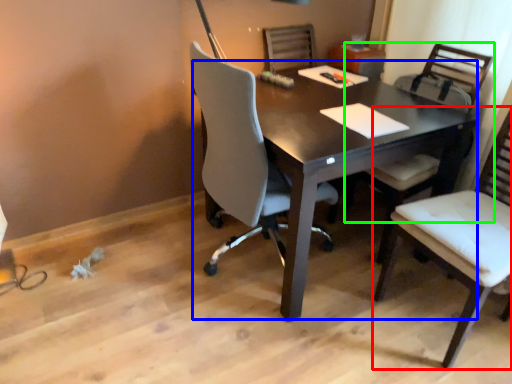
Question: Considering the real-world distances, which object is closest to chair (highlighted by a red box)? desk (highlighted by a blue box) or chair (highlighted by a green box).

Choices:
 (A) desk
 (B) chair

Answer: (B)